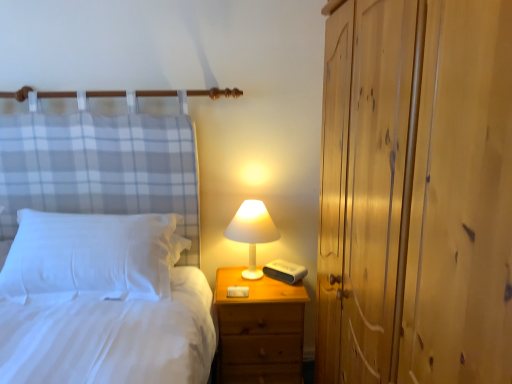
Question: Considering the relative sizes of wooden nightstand at right and white soft pillow at left in the image provided, is wooden nightstand at right wider than white soft pillow at left?

Choices:
 (A) yes
 (B) no

Answer: (A)

Question: Can you confirm if wooden nightstand at right is positioned to the left of white soft pillow at left?

Choices:
 (A) no
 (B) yes

Answer: (A)

Question: Considering the relative sizes of wooden nightstand at right and white soft pillow at left in the image provided, is wooden nightstand at right smaller than white soft pillow at left?

Choices:
 (A) yes
 (B) no

Answer: (B)

Question: Is wooden nightstand at right thinner than white soft pillow at left?

Choices:
 (A) yes
 (B) no

Answer: (B)

Question: Is wooden nightstand at right positioned with its back to white soft pillow at left?

Choices:
 (A) no
 (B) yes

Answer: (A)

Question: Considering the positions of point (141, 274) and point (476, 185), is point (141, 274) closer or farther from the camera than point (476, 185)?

Choices:
 (A) farther
 (B) closer

Answer: (A)

Question: Considering the positions of white soft pillow at left and wooden dresser at right in the image, is white soft pillow at left wider or thinner than wooden dresser at right?

Choices:
 (A) thin
 (B) wide

Answer: (A)

Question: Based on their positions, is white soft pillow at left located to the left or right of wooden dresser at right?

Choices:
 (A) left
 (B) right

Answer: (A)

Question: Choose the correct answer: Is white soft pillow at left inside wooden dresser at right or outside it?

Choices:
 (A) outside
 (B) inside

Answer: (A)

Question: From a real-world perspective, is wooden nightstand at right physically located above or below wooden dresser at right?

Choices:
 (A) above
 (B) below

Answer: (B)

Question: Considering their positions, is wooden nightstand at right located in front of or behind wooden dresser at right?

Choices:
 (A) front
 (B) behind

Answer: (B)

Question: Looking at their shapes, would you say wooden nightstand at right is wider or thinner than wooden dresser at right?

Choices:
 (A) wide
 (B) thin

Answer: (B)

Question: Is wooden nightstand at right bigger or smaller than wooden dresser at right?

Choices:
 (A) small
 (B) big

Answer: (A)

Question: In terms of size, does white matte table lamp at upper right appear bigger or smaller than white soft pillow at left?

Choices:
 (A) big
 (B) small

Answer: (B)

Question: From a real-world perspective, is white matte table lamp at upper right physically located above or below white soft pillow at left?

Choices:
 (A) below
 (B) above

Answer: (A)